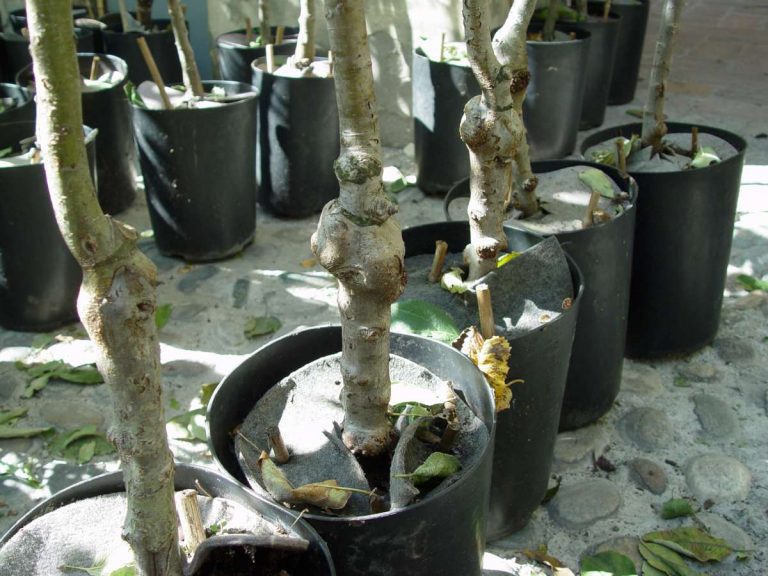
Locate an element on the screen. The image size is (768, 576). pot is located at coordinates [x=445, y=525].